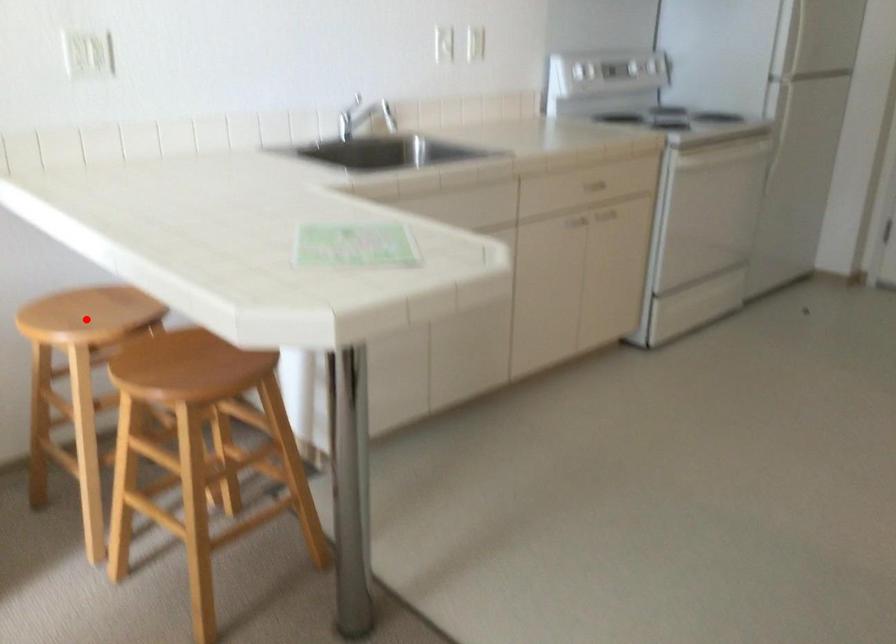
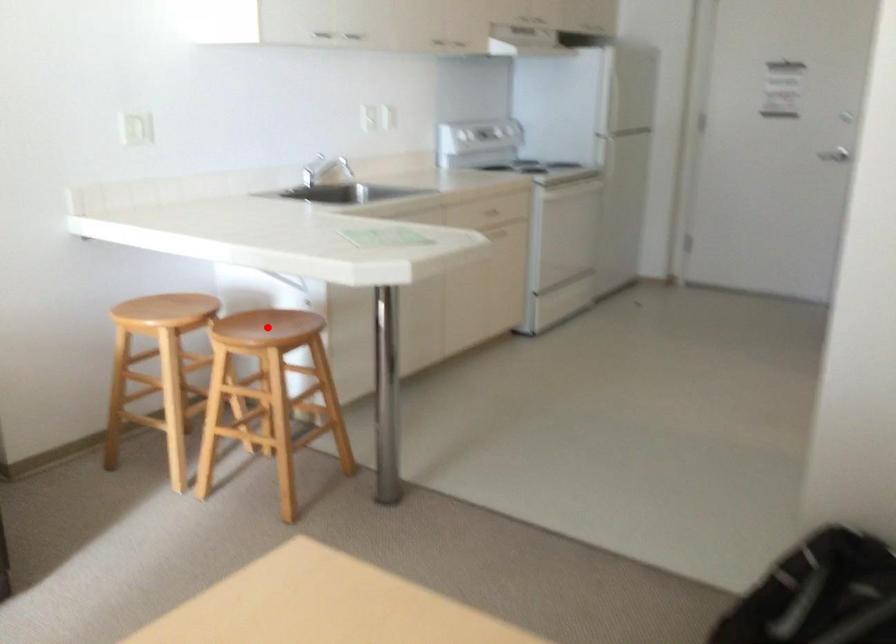
I am providing you with two images of the same scene from different viewpoints. A red point is marked on the first image and another point is marked on the second image. Do the highlighted points in image1 and image2 indicate the same real-world spot?

No